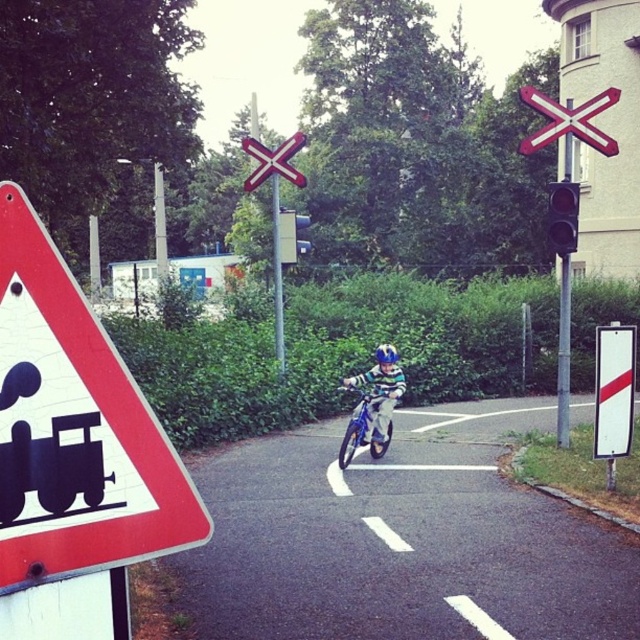
Who is more distant from viewer, (520, 93) or (275, 163)?

Point (275, 163)

Image resolution: width=640 pixels, height=640 pixels. What do you see at coordinates (568, 120) in the screenshot?
I see `brushed metal railroad crossing sign at upper center` at bounding box center [568, 120].

Who is more distant from viewer, (554, 118) or (292, 177)?

Point (292, 177)

The image size is (640, 640). In order to click on brushed metal railroad crossing sign at upper center in this screenshot , I will do `click(568, 120)`.

Can you confirm if brushed metal railroad crossing sign at upper center is wider than metallic silver dirt bike at center?

Yes, brushed metal railroad crossing sign at upper center is wider than metallic silver dirt bike at center.

Which is below, brushed metal railroad crossing sign at upper center or metallic silver dirt bike at center?

metallic silver dirt bike at center

This screenshot has height=640, width=640. What do you see at coordinates (568, 120) in the screenshot?
I see `brushed metal railroad crossing sign at upper center` at bounding box center [568, 120].

Identify the location of brushed metal railroad crossing sign at upper center. Image resolution: width=640 pixels, height=640 pixels. (568, 120).

Can you confirm if brushed metal railroad crossing sign at upper center is shorter than metallic silver bicycle at center?

In fact, brushed metal railroad crossing sign at upper center may be taller than metallic silver bicycle at center.

Describe the element at coordinates (568, 120) in the screenshot. This screenshot has height=640, width=640. I see `brushed metal railroad crossing sign at upper center` at that location.

The image size is (640, 640). I want to click on brushed metal railroad crossing sign at upper center, so click(x=568, y=120).

Image resolution: width=640 pixels, height=640 pixels. Identify the location of brushed metal railroad crossing sign at upper center. (568, 120).